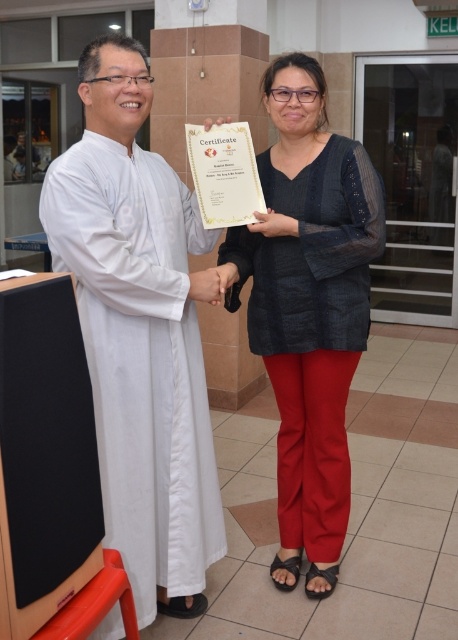
You are an event photographer at a formal ceremony. You need to capture a photo of the white clothed man at left and the matte black blouse at center. Based on their positions, which one is closer to the camera?

The white clothed man at left is closer to the camera because he is positioned in front of the matte black blouse at center.

You are an event planner arranging a photo shoot. You need to position the white clothed man at left and the matte black blouse at center so that both are visible in the frame. Given their sizes, which object should be placed closer to the camera to ensure visibility?

The white clothed man at left is bigger than the matte black blouse at center, so placing the matte black blouse at center closer to the camera will help balance their sizes and ensure both are visible in the frame.